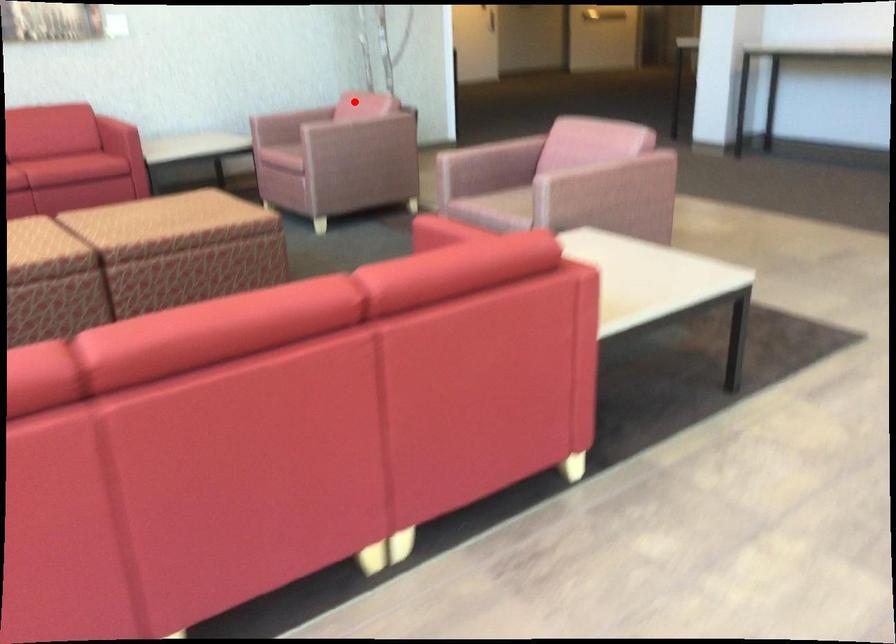
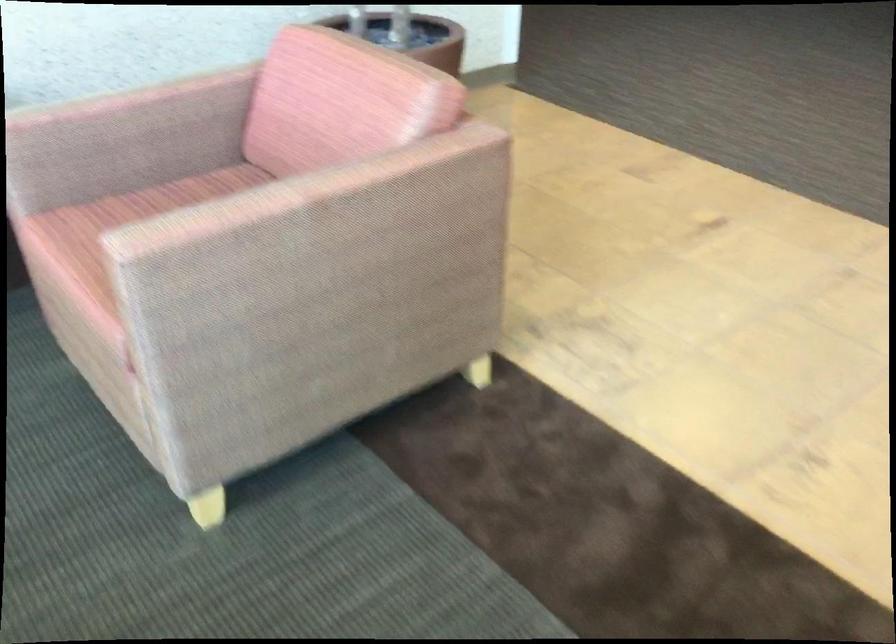
Find the pixel in the second image that matches the highlighted location in the first image.

(298, 192)